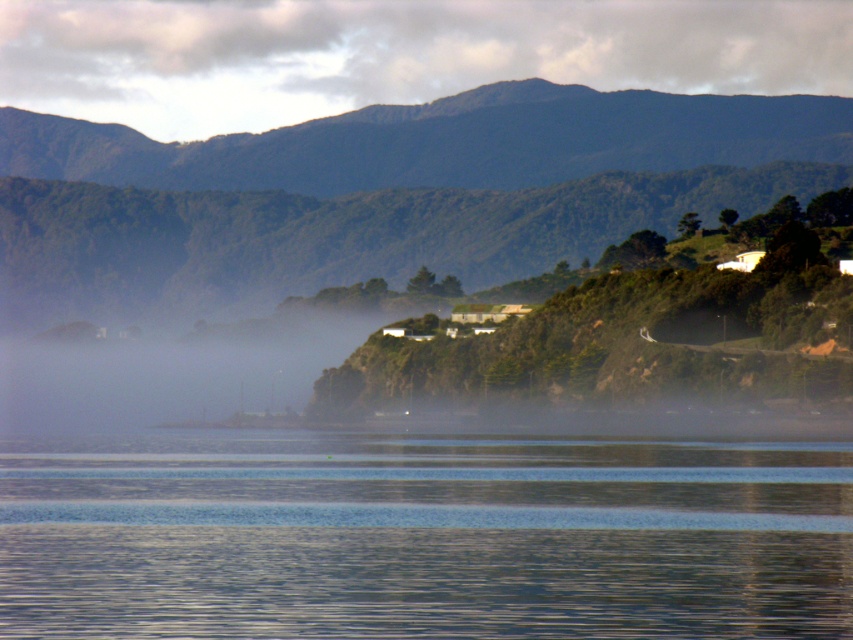
Which is in front, point (425, 605) or point (15, 180)?

Point (425, 605) is more forward.

Can you confirm if transparent glass water at center is shorter than green forested mountain at upper center?

Yes.

Is point (462, 518) farther from viewer compared to point (480, 131)?

No, (462, 518) is in front of (480, 131).

Locate an element on the screen. transparent glass water at center is located at coordinates (422, 536).

Can you confirm if green forested mountain at upper center is shorter than dark green textured mountain at upper center?

In fact, green forested mountain at upper center may be taller than dark green textured mountain at upper center.

Consider the image. How much distance is there between green forested mountain at upper center and dark green textured mountain at upper center?

green forested mountain at upper center is 18.28 feet from dark green textured mountain at upper center.

Is point (312, 284) positioned after point (532, 166)?

No, it is in front of (532, 166).

I want to click on green forested mountain at upper center, so click(x=387, y=189).

Can you confirm if transparent glass water at center is positioned above dark green textured mountain at upper center?

Actually, transparent glass water at center is below dark green textured mountain at upper center.

Does transparent glass water at center appear under dark green textured mountain at upper center?

Yes.

Identify the location of transparent glass water at center. The image size is (853, 640). (422, 536).